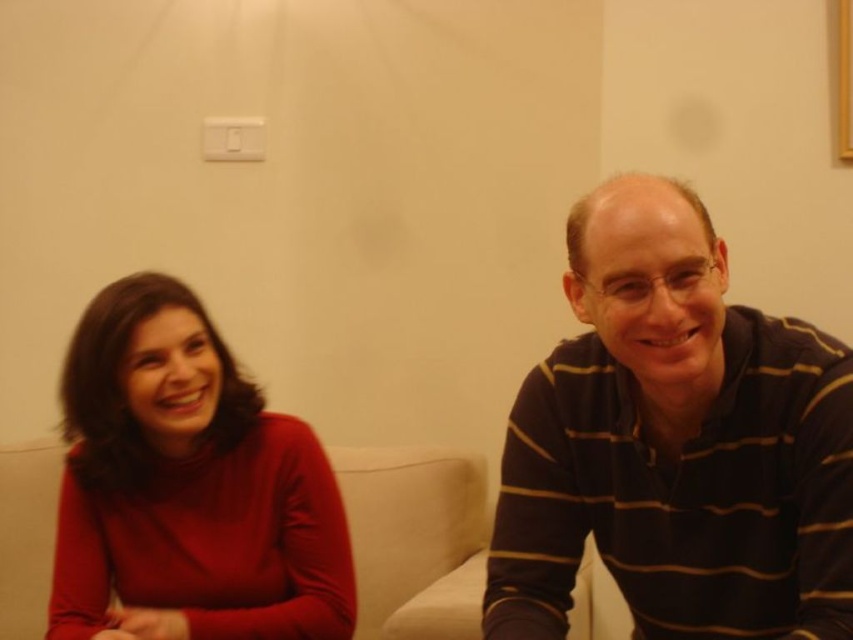
Question: Which point is closer to the camera taking this photo?

Choices:
 (A) (70, 344)
 (B) (363, 620)
 (C) (747, 454)

Answer: (C)

Question: Which point appears closest to the camera in this image?

Choices:
 (A) (476, 621)
 (B) (216, 369)
 (C) (664, 582)

Answer: (C)

Question: Considering the real-world distances, which object is closest to the black striped shirt at right?

Choices:
 (A) white fabric couch at center
 (B) matte red sweater at left

Answer: (B)

Question: Does black striped shirt at right have a smaller size compared to matte red sweater at left?

Choices:
 (A) no
 (B) yes

Answer: (A)

Question: Is black striped shirt at right to the left of matte red sweater at left from the viewer's perspective?

Choices:
 (A) yes
 (B) no

Answer: (B)

Question: Is matte red sweater at left below white fabric couch at center?

Choices:
 (A) no
 (B) yes

Answer: (A)